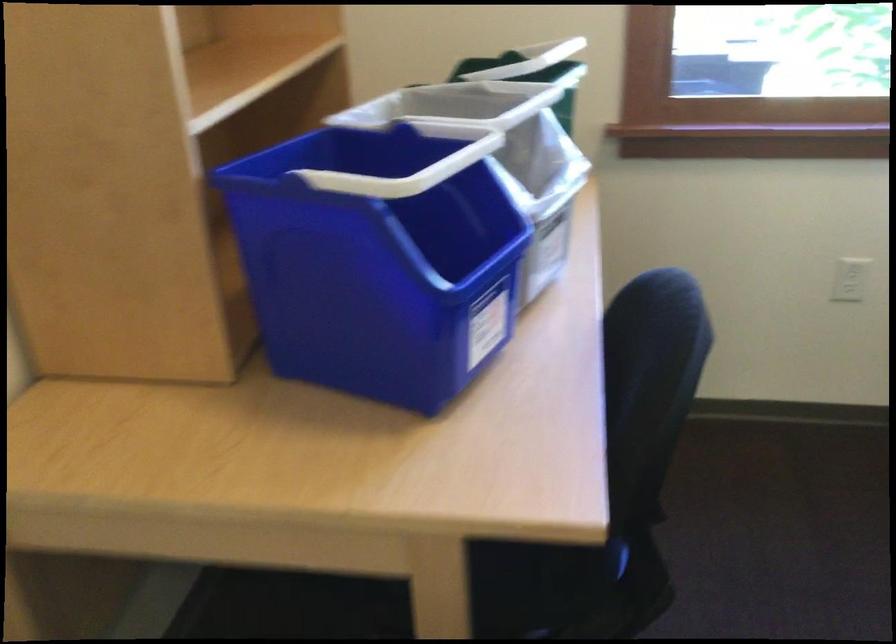
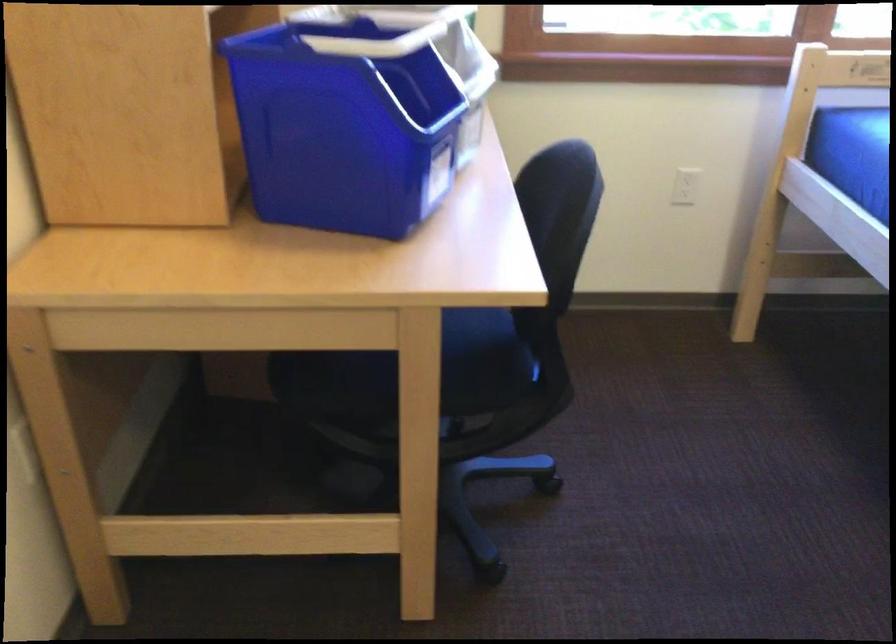
Locate, in the second image, the point that corresponds to the point at 623,100 in the first image.

(506, 26)